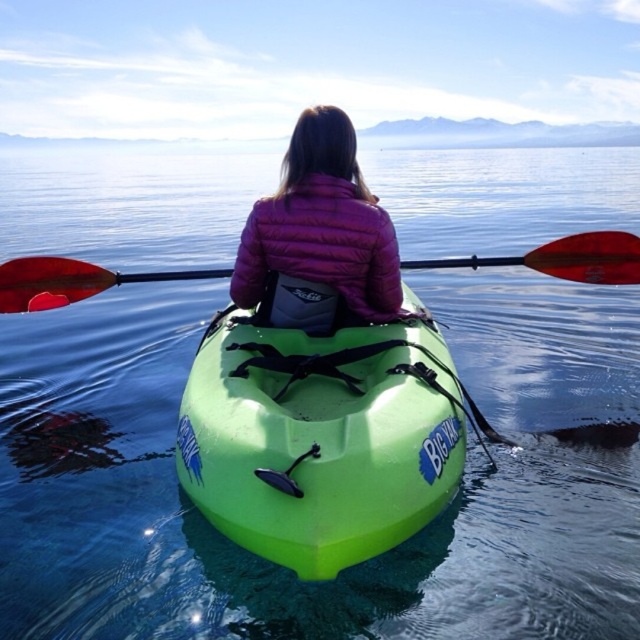
You are a photographer trying to capture the purple puffy jacket at center and the green plastic canoe at center in the same frame. Since the camera can only focus on one object at a time, which object should you focus on first if you want to ensure both are in the frame?

The purple puffy jacket at center is to the left of the green plastic canoe at center, so you should focus on the purple puffy jacket at center first to ensure both are in the frame.

You are a photographer trying to capture the kayaker in the image. You want to ensure both the purple puffy jacket at center and the red plastic paddle at center are clearly visible in your shot. Based on their positions, which object should you focus on first to ensure both are in frame?

The purple puffy jacket at center is below the red plastic paddle at center. Since the jacket is lower, you should focus on the red plastic paddle at center first to ensure both are in frame as you adjust your camera angle.

You need to reach the purple puffy jacket at center from the green plastic canoe at center. What is the minimum distance you need to move?

The minimum distance between the green plastic canoe at center and the purple puffy jacket at center is 33.75 inches, so you need to move at least 33.75 inches to reach it.